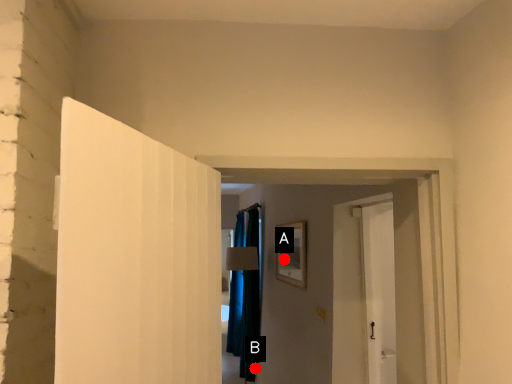
Question: Two points are circled on the image, labeled by A and B beside each circle. Which point appears farthest from the camera in this image?

Choices:
 (A) A is further
 (B) B is further

Answer: (B)